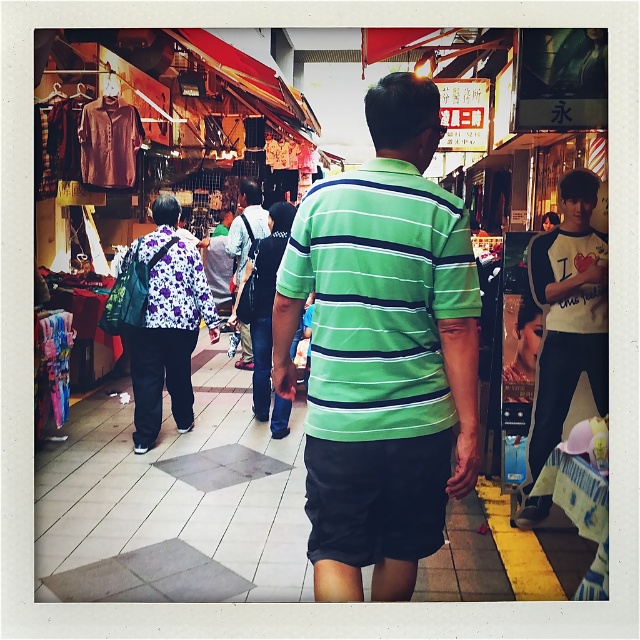
Question: Which of the following is the farthest from the observer?

Choices:
 (A) (180, 244)
 (B) (420, 524)

Answer: (A)

Question: Can you confirm if white cotton t-shirt at right is thinner than floral fabric shirt at center?

Choices:
 (A) yes
 (B) no

Answer: (A)

Question: Is floral fabric shirt at center to the left of denim shorts at center from the viewer's perspective?

Choices:
 (A) yes
 (B) no

Answer: (A)

Question: Which of the following is the farthest from the observer?

Choices:
 (A) floral fabric shirt at center
 (B) white cotton t-shirt at right
 (C) green striped polo shirt at center
 (D) denim shorts at center

Answer: (D)

Question: Is white cotton t-shirt at right bigger than denim shorts at center?

Choices:
 (A) no
 (B) yes

Answer: (A)

Question: Among these points, which one is nearest to the camera?

Choices:
 (A) (253, 234)
 (B) (582, 307)
 (C) (129, 316)
 (D) (336, 291)

Answer: (D)